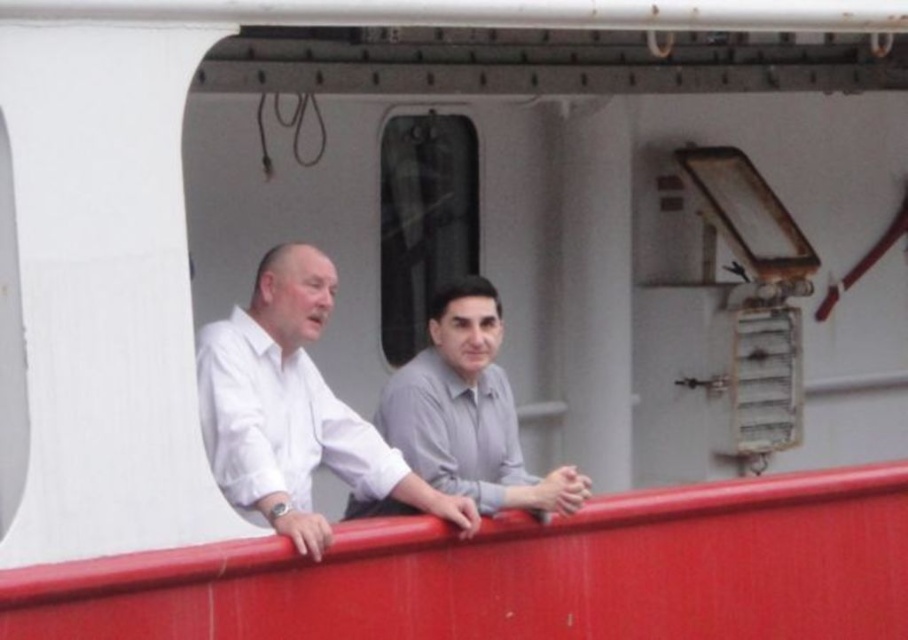
Based on the photo, you are on a ship deck and want to determine which of the two points, point [297,520] or point [421,385], is nearer to you. Based on the scene description, which point is closer?

Point [297,520] is closer to the camera than point [421,385], so it is the nearer point.

You are standing on the deck of a ship and want to reach the smooth glossy red rail at center. If your maximum reach is 2 meters, can you touch it without moving closer?

The smooth glossy red rail at center is 4.15 meters away from the viewer. Since your maximum reach is only 2 meters, you cannot touch it without moving closer.